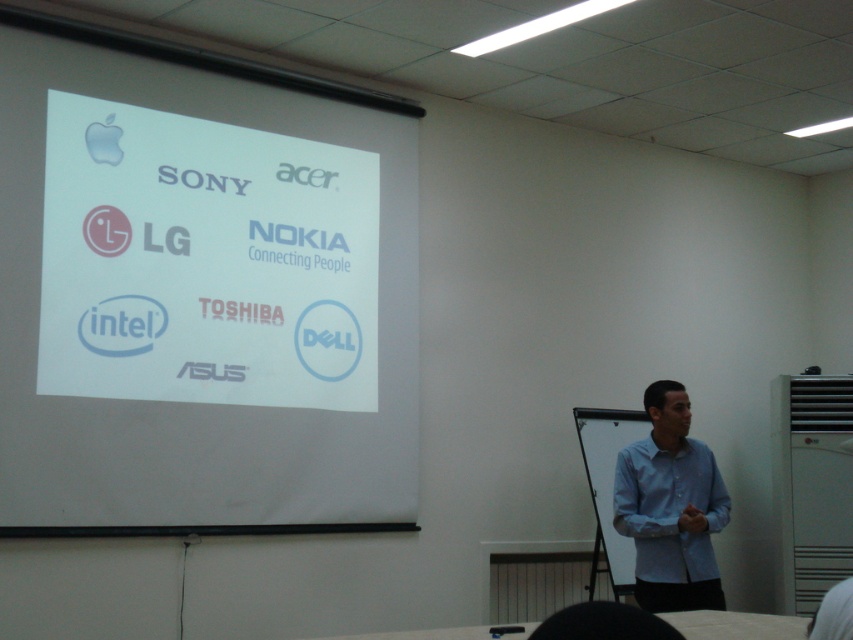
Between point (276, 477) and point (636, 552), which one is positioned in front?

Point (636, 552)

Is point (401, 305) positioned in front of point (666, 497)?

No, (401, 305) is behind (666, 497).

The height and width of the screenshot is (640, 853). What are the coordinates of `white paper at upper left` in the screenshot? It's located at (201, 298).